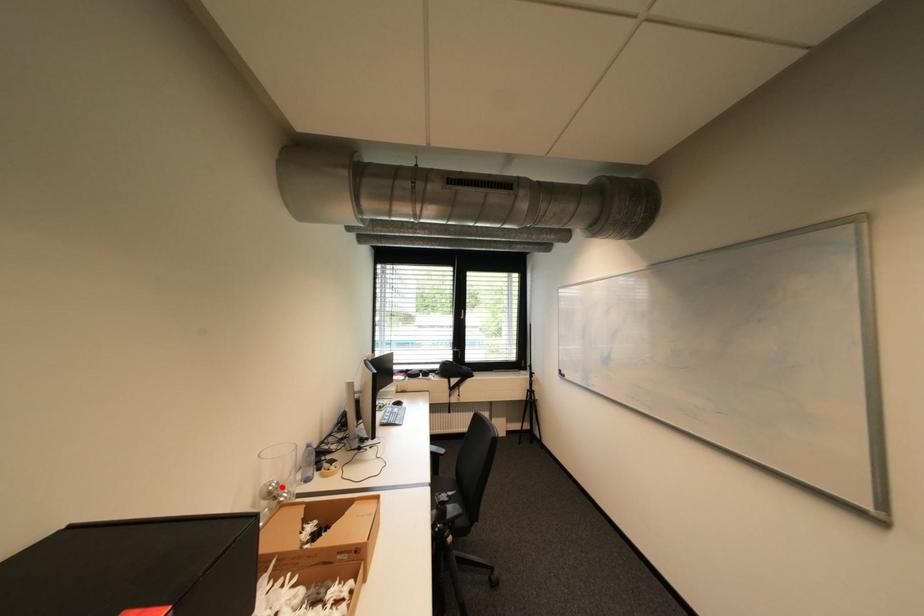
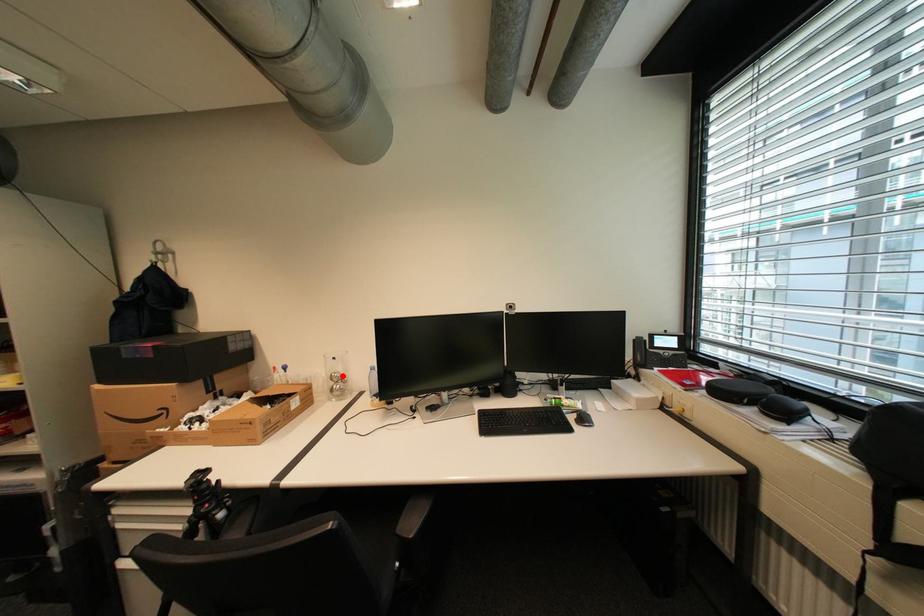
I am providing you with two images of the same scene from different viewpoints. A red point is marked on the first image and another point is marked on the second image. Are the points marked in image1 and image2 representing the same 3D position?

Yes